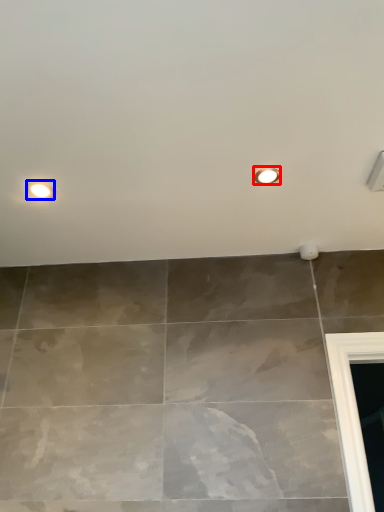
Question: Which object appears closest to the camera in this image, droplight (highlighted by a red box) or droplight (highlighted by a blue box)?

Choices:
 (A) droplight
 (B) droplight

Answer: (A)